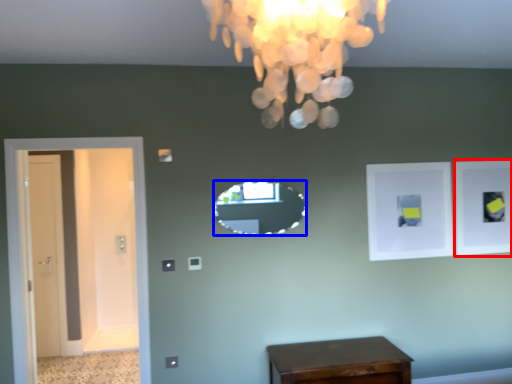
Question: Which object appears closest to the camera in this image, picture frame (highlighted by a red box) or mirror (highlighted by a blue box)?

Choices:
 (A) picture frame
 (B) mirror

Answer: (B)